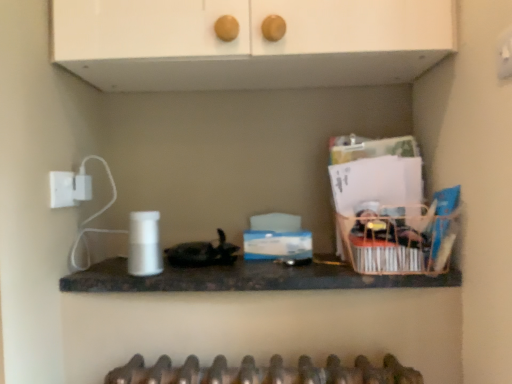
Question: Should I look upward or downward to see wooden basket at right?

Choices:
 (A) down
 (B) up

Answer: (A)

Question: Is black marble countertop at center directly adjacent to white matte cabinet at upper center?

Choices:
 (A) no
 (B) yes

Answer: (A)

Question: From the image's perspective, is black marble countertop at center over white matte cabinet at upper center?

Choices:
 (A) no
 (B) yes

Answer: (A)

Question: Is black marble countertop at center closer to camera compared to white matte cabinet at upper center?

Choices:
 (A) yes
 (B) no

Answer: (B)

Question: Is black marble countertop at center positioned behind white matte cabinet at upper center?

Choices:
 (A) no
 (B) yes

Answer: (B)

Question: Is black marble countertop at center to the right of white matte cabinet at upper center from the viewer's perspective?

Choices:
 (A) no
 (B) yes

Answer: (B)

Question: Is black marble countertop at center located outside white matte cabinet at upper center?

Choices:
 (A) no
 (B) yes

Answer: (B)

Question: Would you say black marble countertop at center contains wooden basket at right?

Choices:
 (A) yes
 (B) no

Answer: (B)

Question: Is black marble countertop at center shorter than wooden basket at right?

Choices:
 (A) no
 (B) yes

Answer: (B)

Question: Does black marble countertop at center have a smaller size compared to wooden basket at right?

Choices:
 (A) yes
 (B) no

Answer: (B)

Question: Can you confirm if black marble countertop at center is thinner than wooden basket at right?

Choices:
 (A) no
 (B) yes

Answer: (A)

Question: Does black marble countertop at center have a greater height compared to wooden basket at right?

Choices:
 (A) yes
 (B) no

Answer: (B)

Question: Is black marble countertop at center at the right side of wooden basket at right?

Choices:
 (A) yes
 (B) no

Answer: (B)

Question: From the image's perspective, is wooden basket at right on top of white matte cabinet at upper center?

Choices:
 (A) no
 (B) yes

Answer: (A)